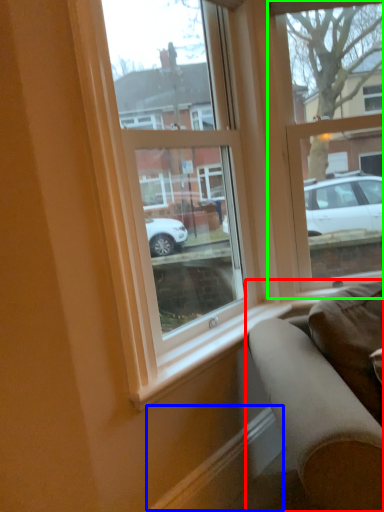
Question: Based on their relative distances, which object is nearer to studio couch (highlighted by a red box)? Choose from curb (highlighted by a blue box) and window (highlighted by a green box).

Choices:
 (A) curb
 (B) window

Answer: (A)